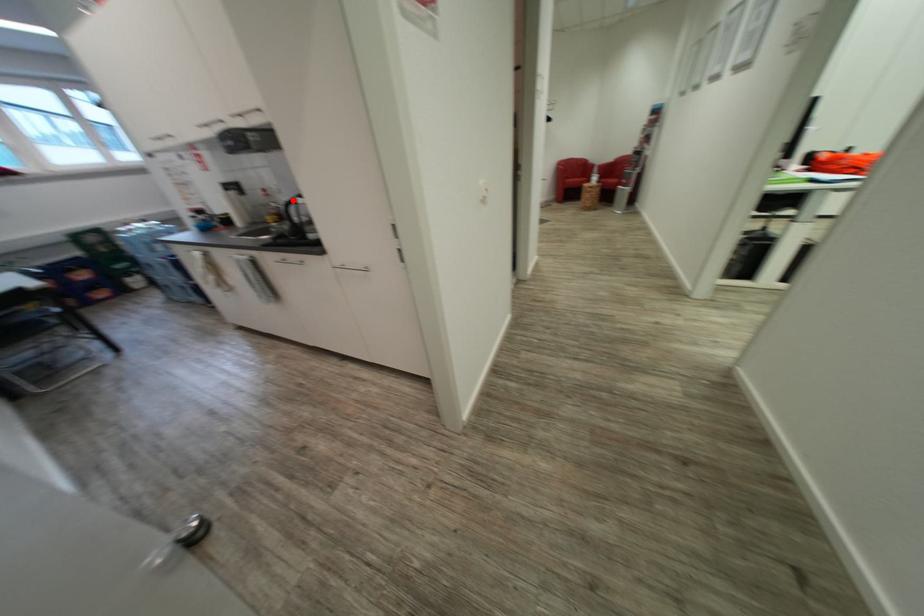
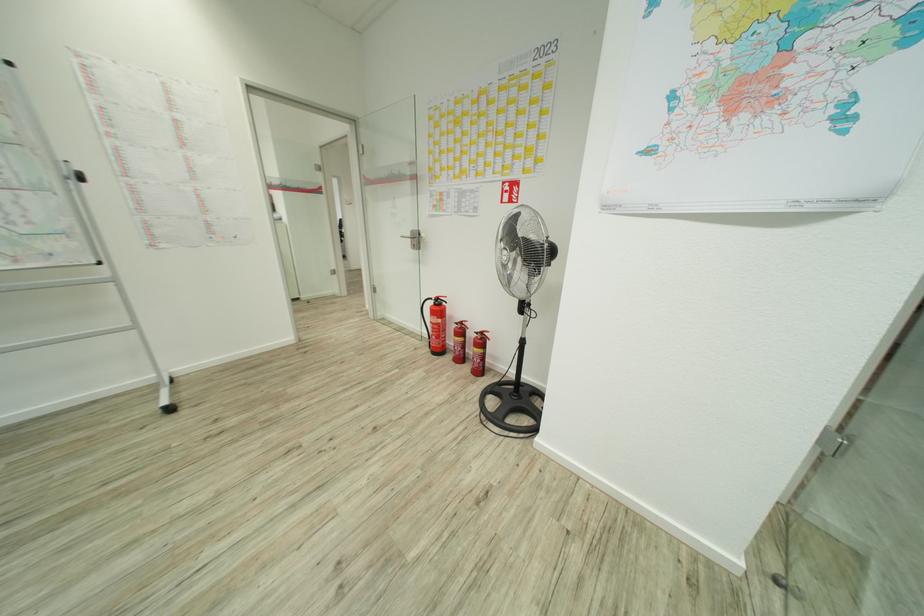
Question: I am providing you with two images of the same scene from different viewpoints. A red point is marked on the first image. Can you still see the location of the red point in image 2?

Choices:
 (A) Yes
 (B) No

Answer: (B)